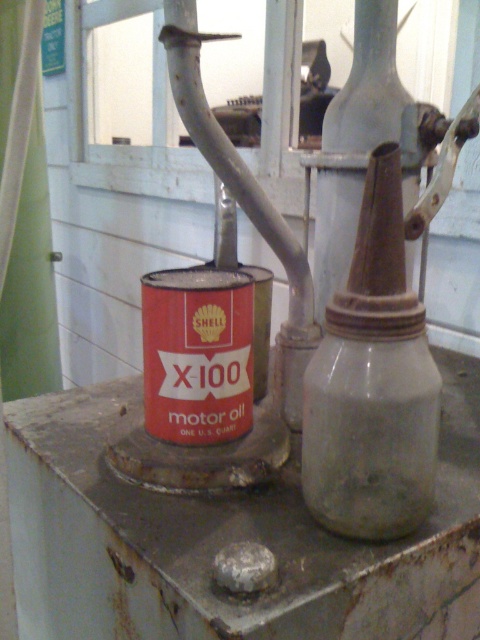
Question: Which of the following is the farthest from the observer?

Choices:
 (A) click(x=360, y=125)
 (B) click(x=357, y=330)

Answer: (A)

Question: In this image, where is matte gray oil canister at center located relative to rusty metal oil canister at center?

Choices:
 (A) right
 (B) left

Answer: (B)

Question: Which point is closer to the camera?

Choices:
 (A) (324, 452)
 (B) (385, 138)

Answer: (A)

Question: Considering the relative positions of matte gray oil canister at center and rusty metal oil canister at center in the image provided, where is matte gray oil canister at center located with respect to rusty metal oil canister at center?

Choices:
 (A) below
 (B) above

Answer: (A)

Question: Which point is closer to the camera?

Choices:
 (A) matte gray oil canister at center
 (B) rusty metal oil canister at center

Answer: (A)

Question: Can you confirm if matte gray oil canister at center is positioned above rusty metal oil canister at center?

Choices:
 (A) yes
 (B) no

Answer: (B)